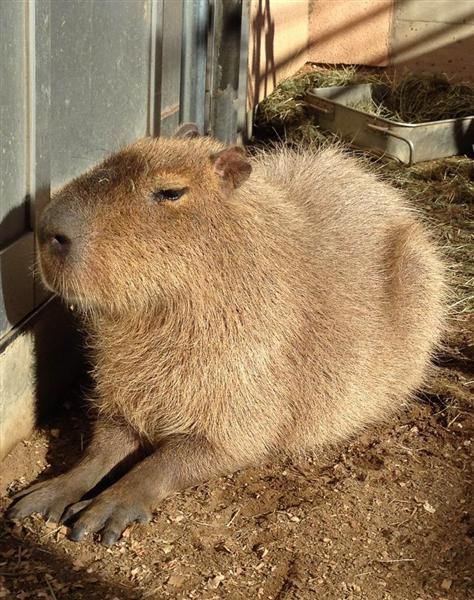
At what (x,y) coordinates should I click in order to perform the action: click on feeding dish. Please return your answer as a coordinate pair (x, y). This screenshot has height=600, width=474. Looking at the image, I should click on pos(350,117).